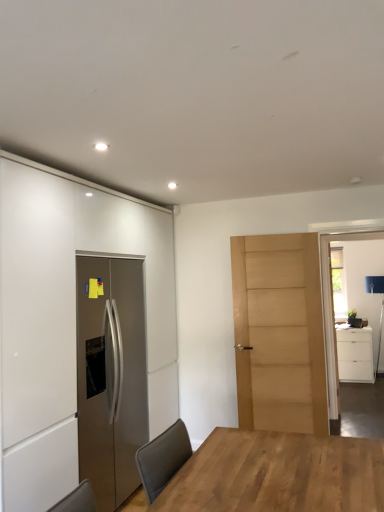
This screenshot has width=384, height=512. I want to click on clear glass door at right, so click(333, 316).

Describe the element at coordinates (278, 474) in the screenshot. Image resolution: width=384 pixels, height=512 pixels. I see `light brown wooden table at center` at that location.

This screenshot has width=384, height=512. I want to click on light brown wooden table at center, so click(x=278, y=474).

In order to click on white matte cabinet at right, the first cabinetry from the back in this screenshot , I will do `click(355, 354)`.

The height and width of the screenshot is (512, 384). I want to click on clear glass door at right, so (333, 316).

Considering the points (265, 329) and (359, 329), which point is behind, point (265, 329) or point (359, 329)?

The point (359, 329) is behind.

In terms of width, does light brown wood door at center look wider or thinner when compared to white matte cabinet at right, acting as the 1th cabinetry starting from the right?

In the image, light brown wood door at center appears to be more narrow than white matte cabinet at right, acting as the 1th cabinetry starting from the right.

From the picture: From a real-world perspective, who is located lower, light brown wood door at center or white matte cabinet at right, acting as the 1th cabinetry starting from the right?

white matte cabinet at right, acting as the 1th cabinetry starting from the right, is physically lower.

Can you confirm if light brown wood door at center is bigger than white matte cabinet at right, the first cabinetry from the back?

No.

Would you consider white matte cabinet at left, the second cabinetry viewed from the back, to be distant from light brown wooden table at center?

white matte cabinet at left, the second cabinetry viewed from the back, is positioned a significant distance from light brown wooden table at center.

Based on the photo, does white matte cabinet at left, the second cabinetry viewed from the back, appear on the right side of light brown wooden table at center?

Incorrect, white matte cabinet at left, the second cabinetry viewed from the back, is not on the right side of light brown wooden table at center.

From a real-world perspective, which is physically below, white matte cabinet at left, the 2th cabinetry in the right-to-left sequence, or light brown wooden table at center?

light brown wooden table at center, from a real-world perspective.

Is white matte cabinet at left, the second cabinetry viewed from the back, turned away from light brown wooden table at center?

white matte cabinet at left, the second cabinetry viewed from the back, is not turned away from light brown wooden table at center.

Visually, is light brown wooden table at center positioned to the left or to the right of light brown wood door at center?

light brown wooden table at center is positioned on light brown wood door at center's left side.

From the image's perspective, which is above, light brown wooden table at center or light brown wood door at center?

light brown wood door at center appears higher in the image.

The width and height of the screenshot is (384, 512). I want to click on door on the right of light brown wooden table at center, so click(x=279, y=333).

Is light brown wooden table at center inside the boundaries of light brown wood door at center, or outside?

light brown wooden table at center is not inside light brown wood door at center, it's outside.

From a real-world perspective, which object rests below the other?

In real-world perspective, light brown wooden table at center is lower.

What's the angular difference between light brown wood door at center and light brown wooden table at center's facing directions?

The facing directions of light brown wood door at center and light brown wooden table at center are 74.6 degrees apart.

Can you confirm if light brown wood door at center is bigger than light brown wooden table at center?

Yes, light brown wood door at center is bigger than light brown wooden table at center.

What's the angular difference between light brown wooden table at center and white matte cabinet at right, the 2th cabinetry viewed from the front,'s facing directions?

There is a 86.2-degree angle between the facing directions of light brown wooden table at center and white matte cabinet at right, the 2th cabinetry viewed from the front.

Who is shorter, light brown wooden table at center or white matte cabinet at right, the first cabinetry from the back?

Standing shorter between the two is light brown wooden table at center.

From the image's perspective, which object appears higher, light brown wooden table at center or white matte cabinet at right, acting as the 1th cabinetry starting from the right?

From the image's view, light brown wooden table at center is above.

In terms of width, does light brown wooden table at center look wider or thinner when compared to white matte cabinet at right, acting as the 1th cabinetry starting from the right?

light brown wooden table at center is thinner than white matte cabinet at right, acting as the 1th cabinetry starting from the right.

Consider the image. From the image's perspective, between light brown wooden table at center and white matte cabinet at left, acting as the 1th cabinetry starting from the left, who is located below?

light brown wooden table at center appears lower in the image.

Measure the distance between light brown wooden table at center and white matte cabinet at left, the 2th cabinetry in the right-to-left sequence.

1.22 meters.

Based on the photo, from a real-world perspective, is light brown wooden table at center positioned above or below white matte cabinet at left, acting as the 1th cabinetry starting from the left?

light brown wooden table at center is below white matte cabinet at left, acting as the 1th cabinetry starting from the left.

Is light brown wooden table at center aimed at white matte cabinet at left, acting as the 1th cabinetry starting from the left?

No, light brown wooden table at center is not facing towards white matte cabinet at left, acting as the 1th cabinetry starting from the left.

Which of these two, clear glass door at right or white matte cabinet at left, acting as the 1th cabinetry starting from the left, is smaller?

Smaller between the two is clear glass door at right.

Image resolution: width=384 pixels, height=512 pixels. Find the location of `cabinetry that is the 1st one when counting downward from the clear glass door at right (from the image's perspective)`. cabinetry that is the 1st one when counting downward from the clear glass door at right (from the image's perspective) is located at coordinates (68, 317).

How far apart are clear glass door at right and white matte cabinet at left, the 2th cabinetry in the right-to-left sequence?

clear glass door at right and white matte cabinet at left, the 2th cabinetry in the right-to-left sequence, are 7.15 feet apart from each other.

Considering the sizes of clear glass door at right and white matte cabinet at left, acting as the 1th cabinetry starting from the left, in the image, is clear glass door at right wider or thinner than white matte cabinet at left, acting as the 1th cabinetry starting from the left,?

Clearly, clear glass door at right has less width compared to white matte cabinet at left, acting as the 1th cabinetry starting from the left.

Identify the location of door above the white matte cabinet at right, acting as the 2th cabinetry starting from the left (from a real-world perspective). This screenshot has height=512, width=384. (279, 333).

I want to click on cabinetry above the light brown wooden table at center (from the image's perspective), so (x=68, y=317).

When comparing their distances from white matte cabinet at left, the second cabinetry viewed from the back, does white matte cabinet at right, the 2th cabinetry viewed from the front, or light brown wooden table at center seem closer?

light brown wooden table at center.

Considering their positions, is clear glass door at right positioned closer to white matte cabinet at left, which is the 1th cabinetry in front-to-back order, than white matte cabinet at right, acting as the 1th cabinetry starting from the right?

Based on the image, clear glass door at right appears to be nearer to white matte cabinet at left, which is the 1th cabinetry in front-to-back order.

Based on their spatial positions, is clear glass door at right or white matte cabinet at left, the 2th cabinetry in the right-to-left sequence, closer to white matte cabinet at right, acting as the 2th cabinetry starting from the left?

clear glass door at right lies closer to white matte cabinet at right, acting as the 2th cabinetry starting from the left, than the other object.

Which object lies nearer to the anchor point light brown wooden table at center, white matte cabinet at left, which is the 1th cabinetry in front-to-back order, or light brown wood door at center?

white matte cabinet at left, which is the 1th cabinetry in front-to-back order, is positioned closer to the anchor light brown wooden table at center.

Which object lies further to the anchor point light brown wooden table at center, clear glass door at right or white matte cabinet at right, the 2th cabinetry viewed from the front?

The object further to light brown wooden table at center is white matte cabinet at right, the 2th cabinetry viewed from the front.

Looking at the image, which one is located closer to light brown wood door at center, white matte cabinet at left, acting as the 1th cabinetry starting from the left, or light brown wooden table at center?

Among the two, white matte cabinet at left, acting as the 1th cabinetry starting from the left, is located nearer to light brown wood door at center.

Based on their spatial positions, is light brown wood door at center or white matte cabinet at right, acting as the 2th cabinetry starting from the left, further from clear glass door at right?

The object further to clear glass door at right is white matte cabinet at right, acting as the 2th cabinetry starting from the left.

Considering their positions, is white matte cabinet at left, the 2th cabinetry in the right-to-left sequence, positioned further to clear glass door at right than light brown wood door at center?

white matte cabinet at left, the 2th cabinetry in the right-to-left sequence.

This screenshot has width=384, height=512. What are the coordinates of `door located between light brown wooden table at center and white matte cabinet at right, acting as the 2th cabinetry starting from the left, in the depth direction` in the screenshot? It's located at (279, 333).

I want to click on door located between white matte cabinet at left, the second cabinetry viewed from the back, and clear glass door at right in the left-right direction, so click(279, 333).

This screenshot has width=384, height=512. Find the location of `table situated between white matte cabinet at left, the 2th cabinetry in the right-to-left sequence, and clear glass door at right from left to right`. table situated between white matte cabinet at left, the 2th cabinetry in the right-to-left sequence, and clear glass door at right from left to right is located at coordinates (278, 474).

Locate an element on the screen. cabinetry between light brown wooden table at center and white matte cabinet at right, acting as the 1th cabinetry starting from the right, from front to back is located at coordinates (68, 317).